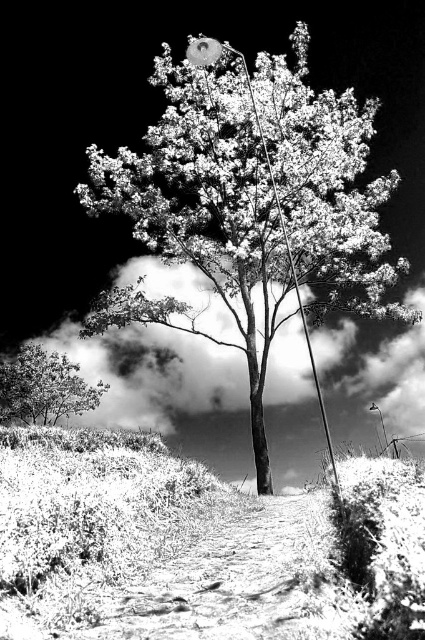
Question: Among these points, which one is farthest from the camera?

Choices:
 (A) (73, 365)
 (B) (209, 212)

Answer: (B)

Question: In this image, where is smooth bark tree at center located relative to smooth green tree at lower left?

Choices:
 (A) below
 (B) above

Answer: (B)

Question: Where is smooth bark tree at center located in relation to smooth green tree at lower left in the image?

Choices:
 (A) right
 (B) left

Answer: (A)

Question: Is smooth bark tree at center above smooth green tree at lower left?

Choices:
 (A) no
 (B) yes

Answer: (B)